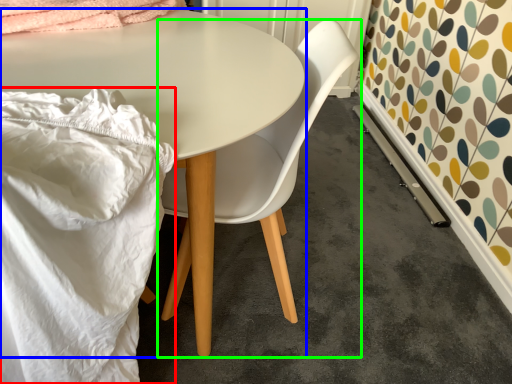
Question: Which is nearer to the blanket (highlighted by a red box)? table (highlighted by a blue box) or chair (highlighted by a green box).

Choices:
 (A) table
 (B) chair

Answer: (A)